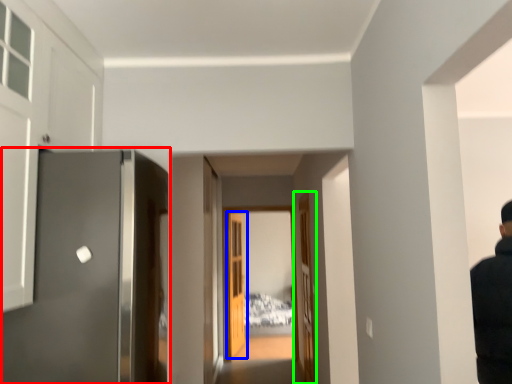
Question: Which object is the closest to the door (highlighted by a red box)? Choose among these: door (highlighted by a blue box) or door (highlighted by a green box).

Choices:
 (A) door
 (B) door

Answer: (B)